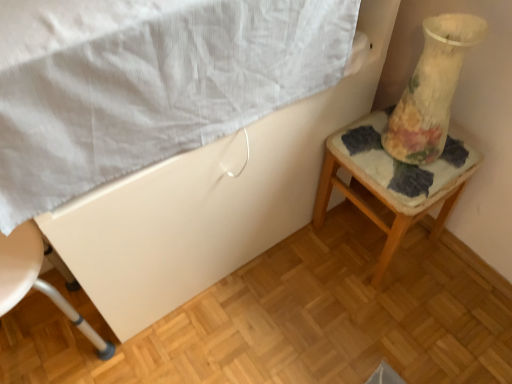
Where is `free region on the left part of floral-patterned glass at right`? free region on the left part of floral-patterned glass at right is located at coordinates (366, 151).